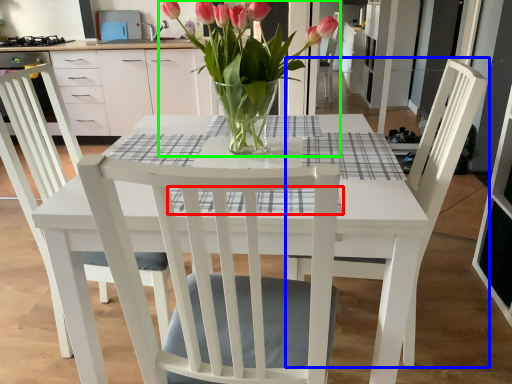
Question: Which object is the closest to the plaid (highlighted by a red box)? Choose among these: chair (highlighted by a blue box) or houseplant (highlighted by a green box).

Choices:
 (A) chair
 (B) houseplant

Answer: (B)